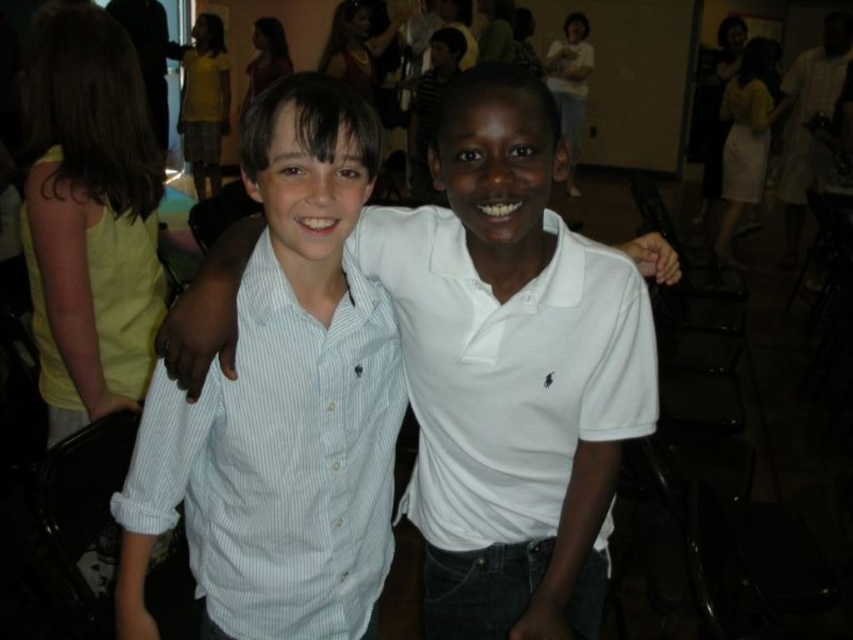
Consider the image. Does white striped shirt at center have a lesser height compared to white cotton polo shirt at center?

No, white striped shirt at center is not shorter than white cotton polo shirt at center.

Based on the photo, which of these two, white striped shirt at center or white cotton polo shirt at center, stands taller?

white striped shirt at center is taller.

Between point (213, 618) and point (432, 468), which one is positioned in front?

Point (213, 618) is more forward.

At what (x,y) coordinates should I click in order to perform the action: click on white striped shirt at center. Please return your answer as a coordinate pair (x, y). Looking at the image, I should click on (274, 448).

Based on the photo, does white cotton polo shirt at center have a lesser width compared to white cotton shirt at center?

Indeed, white cotton polo shirt at center has a lesser width compared to white cotton shirt at center.

Can you confirm if white cotton polo shirt at center is taller than white cotton shirt at center?

No, white cotton polo shirt at center is not taller than white cotton shirt at center.

Locate an element on the screen. Image resolution: width=853 pixels, height=640 pixels. white cotton polo shirt at center is located at coordinates (508, 371).

This screenshot has height=640, width=853. Identify the location of white cotton polo shirt at center. (508, 371).

How far apart are white striped shirt at center and white cotton shirt at center?

They are 6.52 inches apart.

Locate an element on the screen. white striped shirt at center is located at coordinates (274, 448).

Where is `white striped shirt at center`? This screenshot has height=640, width=853. white striped shirt at center is located at coordinates (274, 448).